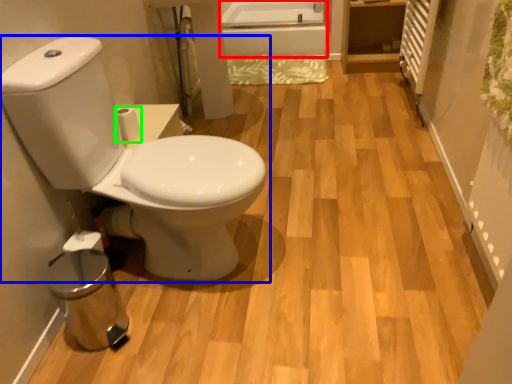
Question: Estimate the real-world distances between objects in this image. Which object is farther from bath (highlighted by a red box), toilet (highlighted by a blue box) or toilet paper (highlighted by a green box)?

Choices:
 (A) toilet
 (B) toilet paper

Answer: (A)